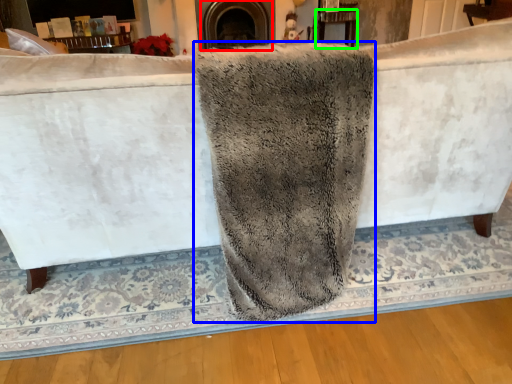
Question: Considering the real-world distances, which object is farthest from fireplace (highlighted by a red box)? bath towel (highlighted by a blue box) or table (highlighted by a green box)?

Choices:
 (A) bath towel
 (B) table

Answer: (A)